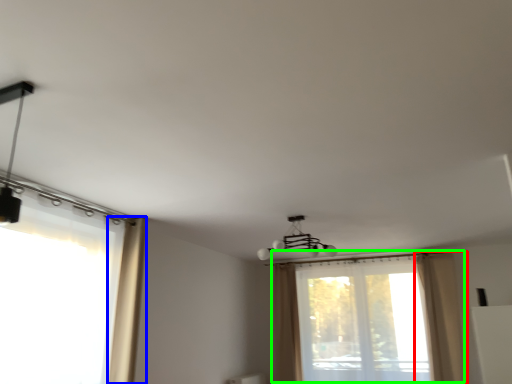
Question: Estimate the real-world distances between objects in this image. Which object is closer to curtain (highlighted by a red box), curtain (highlighted by a blue box) or window (highlighted by a green box)?

Choices:
 (A) curtain
 (B) window

Answer: (B)